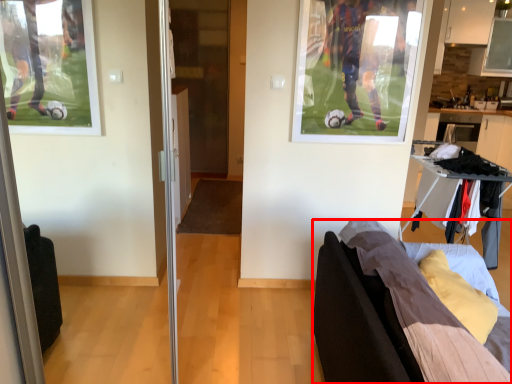
Question: From the image's perspective, where is furniture (annotated by the red box) located in relation to screen door in the image?

Choices:
 (A) below
 (B) above

Answer: (A)